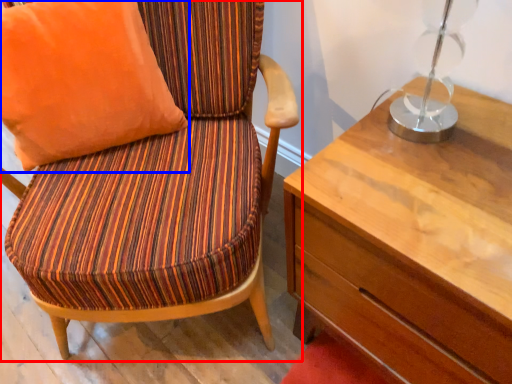
Question: Which point is closer to the camera, chair (highlighted by a red box) or pillow (highlighted by a blue box)?

Choices:
 (A) chair
 (B) pillow

Answer: (A)